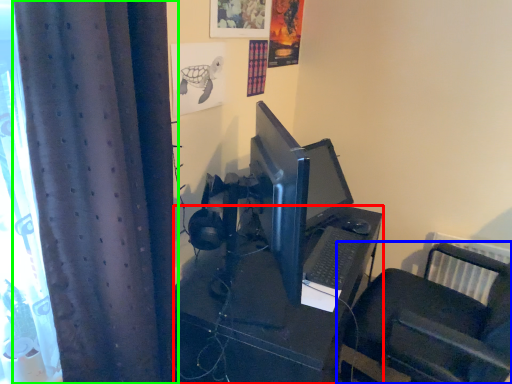
Question: Which is farther away from desk (highlighted by a red box)? furniture (highlighted by a blue box) or curtain (highlighted by a green box)?

Choices:
 (A) furniture
 (B) curtain

Answer: (B)